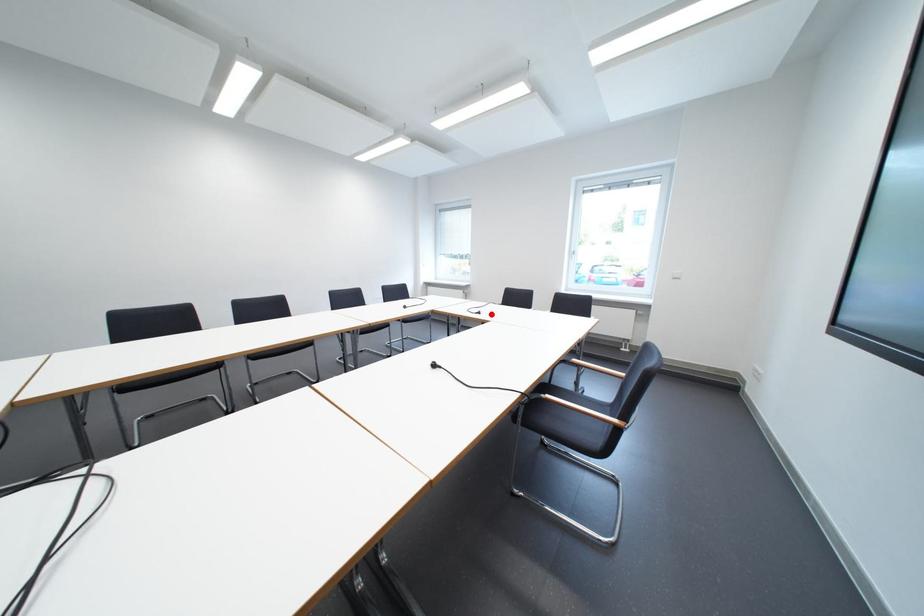
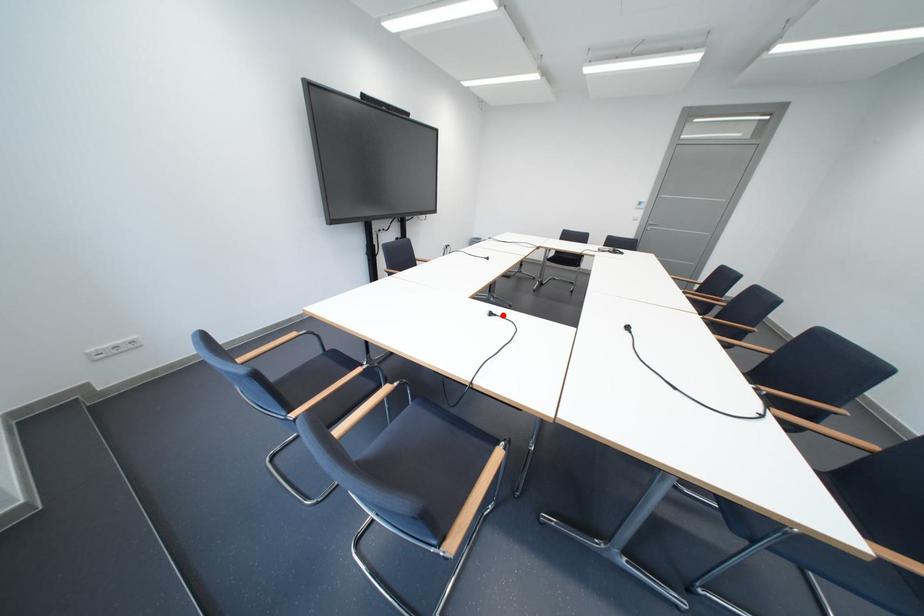
In the scene shown: I am providing you with two images of the same scene from different viewpoints. A red point is marked on the first image and another point is marked on the second image. Is the red point in image1 aligned with the point shown in image2?

Yes